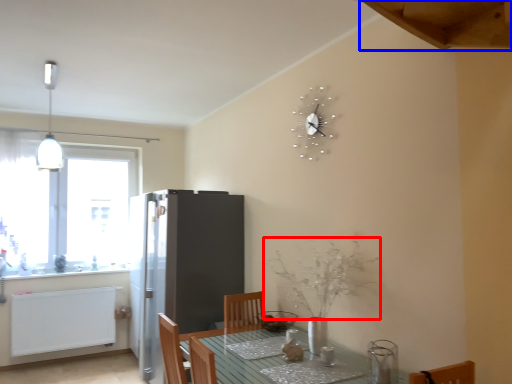
Question: Which object is further to the camera taking this photo, flower (highlighted by a red box) or exhaust hood (highlighted by a blue box)?

Choices:
 (A) flower
 (B) exhaust hood

Answer: (A)